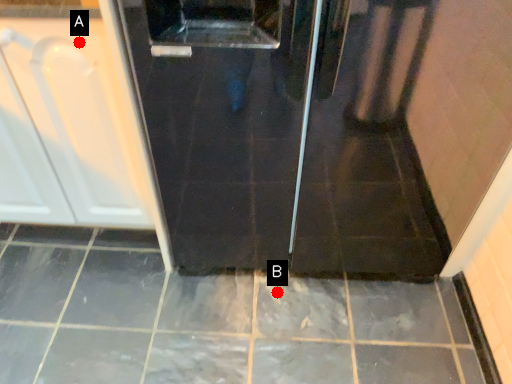
Question: Two points are circled on the image, labeled by A and B beside each circle. Which of the following is the farthest from the observer?

Choices:
 (A) A is further
 (B) B is further

Answer: (B)